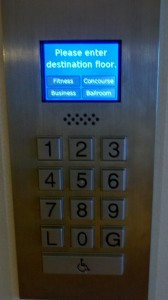
Identify the location of communication speaker. This screenshot has width=168, height=300. (80, 119).